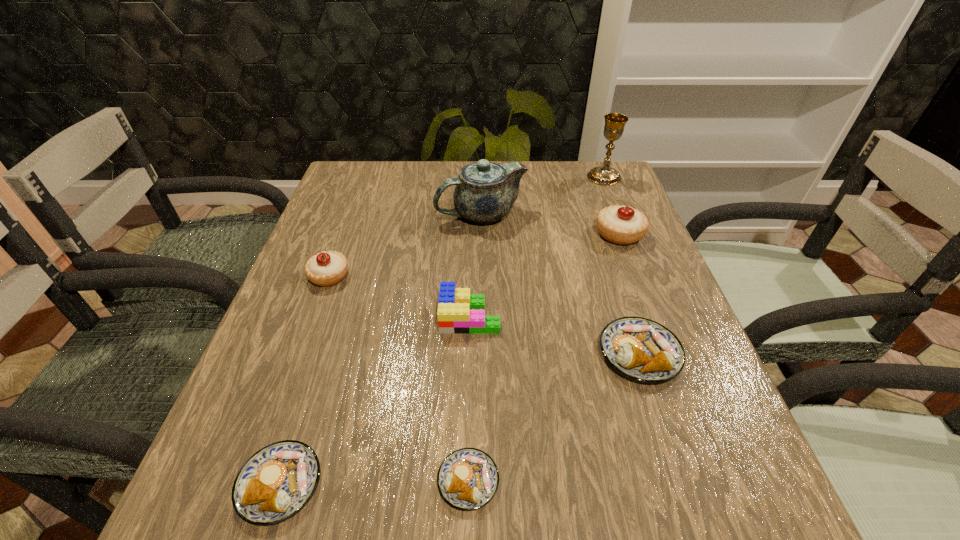
Locate an element on the screen. This screenshot has height=540, width=960. vacant space at the right edge is located at coordinates (639, 274).

Where is `vacant space at the far right corner`? The image size is (960, 540). vacant space at the far right corner is located at coordinates click(x=608, y=199).

In the image, there is a desktop. Identify the location of vacant space at the near right corner. (667, 529).

This screenshot has width=960, height=540. Find the location of `free spot between the sixth shortest object and the second tallest object`. free spot between the sixth shortest object and the second tallest object is located at coordinates (550, 224).

Where is `vacant area that lies between the rightmost brown pastry and the farthest object`? This screenshot has height=540, width=960. vacant area that lies between the rightmost brown pastry and the farthest object is located at coordinates (622, 265).

This screenshot has height=540, width=960. Find the location of `empty space that is in between the tallest pastry and the seventh shortest object`. empty space that is in between the tallest pastry and the seventh shortest object is located at coordinates (550, 224).

Locate an element on the screen. The height and width of the screenshot is (540, 960). free space between the nearer beige pastry and the chalice is located at coordinates (467, 227).

At what (x,y) coordinates should I click in order to perform the action: click on free space between the smaller beige pastry and the farthest object. Please return your answer as a coordinate pair (x, y). This screenshot has width=960, height=540. Looking at the image, I should click on (467, 227).

Identify the location of vacant region between the right beige pastry and the leftmost brown pastry. (449, 359).

You are a GUI agent. You are given a task and a screenshot of the screen. Output one action in this format:
    pyautogui.click(x=<x>, y=<y>)
    Task: Click on the free area in between the third nearest pastry and the chinaware
    This screenshot has width=960, height=540.
    Given the screenshot: What is the action you would take?
    pyautogui.click(x=561, y=284)